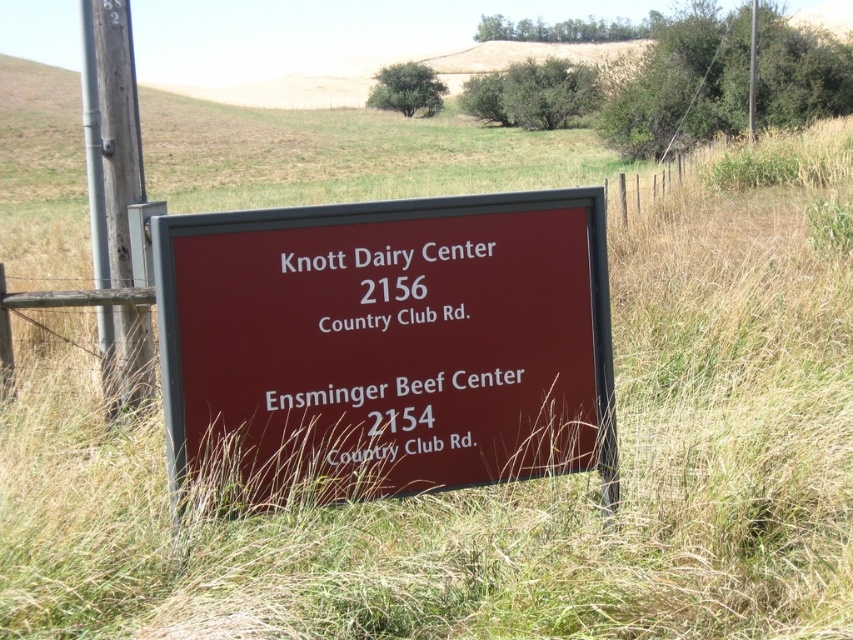
Is the position of maroon plastic sign at center less distant than that of maroon sign at center?

Yes, it is.

Is maroon plastic sign at center thinner than maroon sign at center?

In fact, maroon plastic sign at center might be wider than maroon sign at center.

Locate an element on the screen. maroon plastic sign at center is located at coordinates (387, 344).

Can you confirm if maroon sign at center is bigger than gray metallic pole at left?

Incorrect, maroon sign at center is not larger than gray metallic pole at left.

Can you confirm if maroon sign at center is thinner than gray metallic pole at left?

Incorrect, maroon sign at center's width is not less than gray metallic pole at left's.

Where is `maroon sign at center`? maroon sign at center is located at coordinates (399, 340).

Locate an element on the screen. Image resolution: width=853 pixels, height=640 pixels. maroon sign at center is located at coordinates (399, 340).

Who is positioned more to the right, maroon plastic sign at center or gray metallic pole at left?

maroon plastic sign at center is more to the right.

Between maroon plastic sign at center and gray metallic pole at left, which one is positioned lower?

maroon plastic sign at center is below.

What are the coordinates of `maroon plastic sign at center` in the screenshot? It's located at (387, 344).